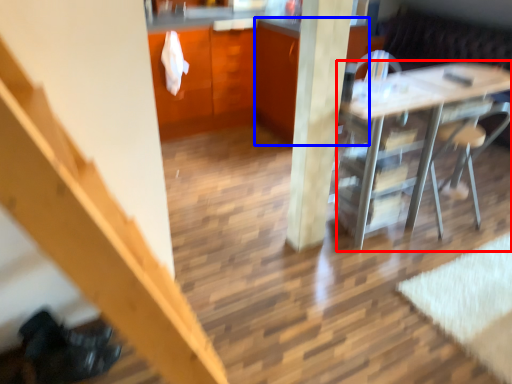
Question: Which object is further to the camera taking this photo, desk (highlighted by a red box) or cabinetry (highlighted by a blue box)?

Choices:
 (A) desk
 (B) cabinetry

Answer: (B)